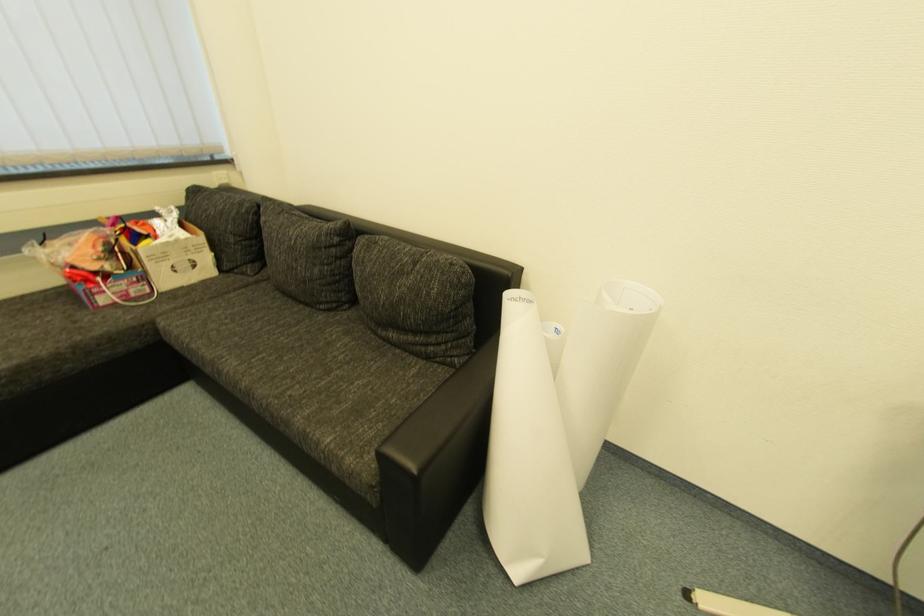
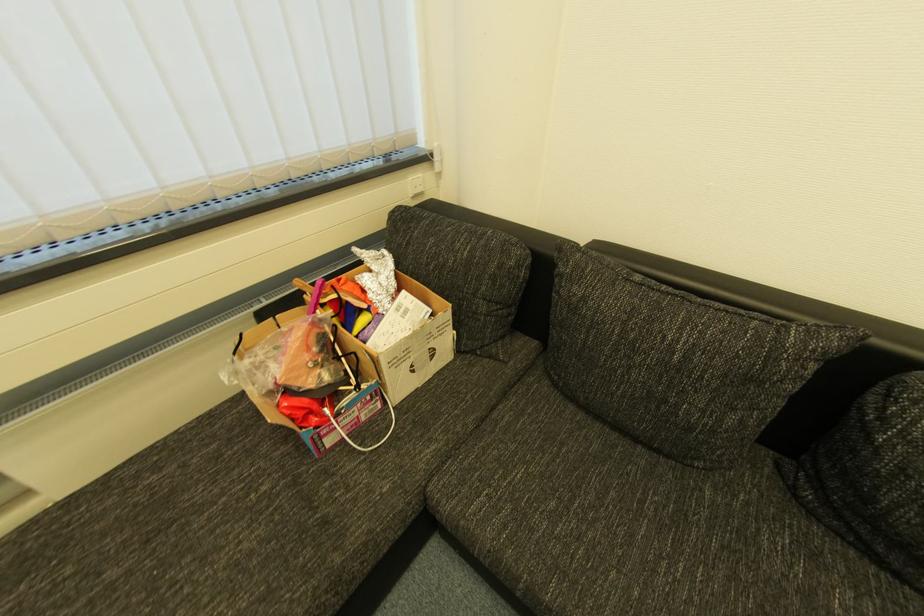
In a continuous first-person perspective shot, in which direction is the camera moving?

The cameraman moved toward left, forward.